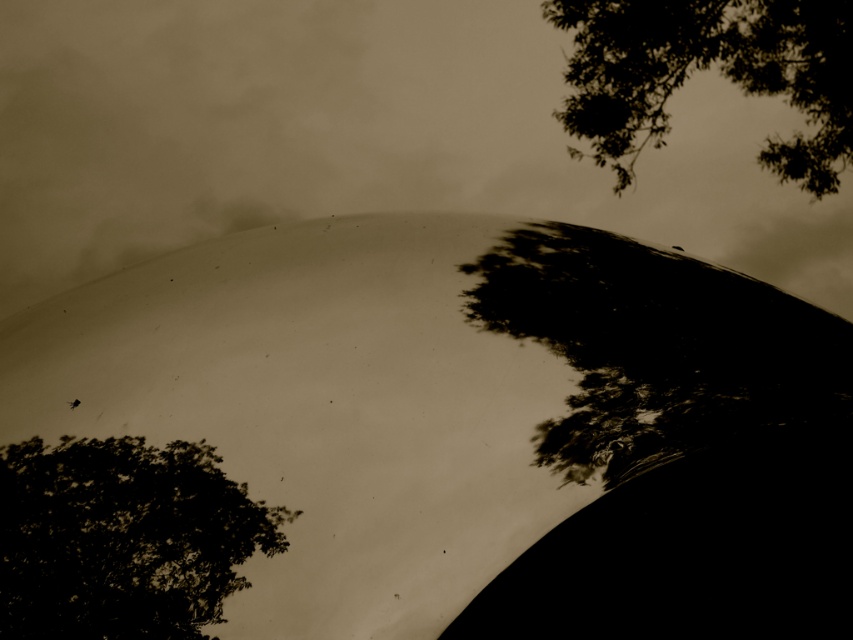
Question: Which of these objects is positioned closest to the dark green leafy tree at lower left?

Choices:
 (A) green leafy branches at upper right
 (B) white matte cloud at center

Answer: (B)

Question: Is white matte cloud at center behind dark green leafy tree at lower left?

Choices:
 (A) yes
 (B) no

Answer: (A)

Question: Is dark green leafy tree at lower left to the left of green leafy branches at upper right from the viewer's perspective?

Choices:
 (A) no
 (B) yes

Answer: (B)

Question: Which point is farther to the camera?

Choices:
 (A) (171, 188)
 (B) (230, 563)

Answer: (A)

Question: Is white matte cloud at center wider than dark green leafy tree at lower left?

Choices:
 (A) no
 (B) yes

Answer: (B)

Question: Among these points, which one is farthest from the camera?

Choices:
 (A) (834, 109)
 (B) (221, 612)
 (C) (190, 179)

Answer: (C)